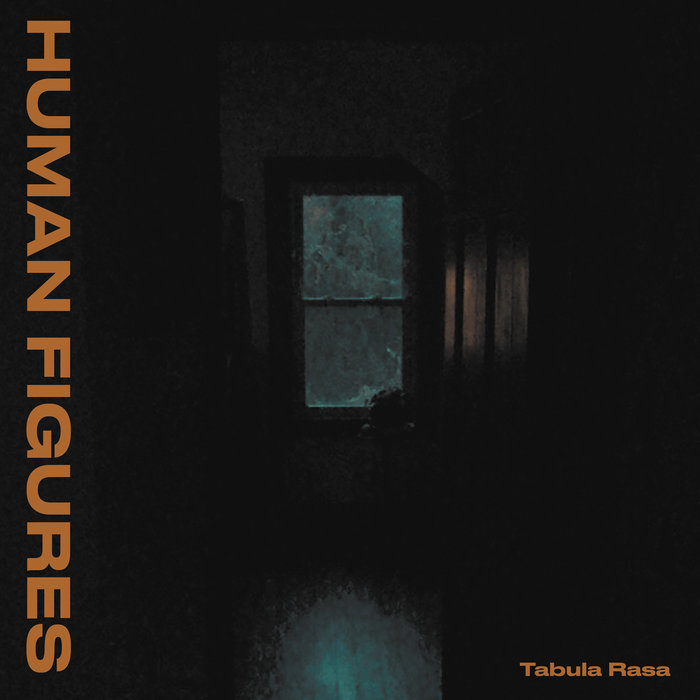
Image resolution: width=700 pixels, height=700 pixels. What are the coordinates of `window sill` in the screenshot? It's located at (350, 407).